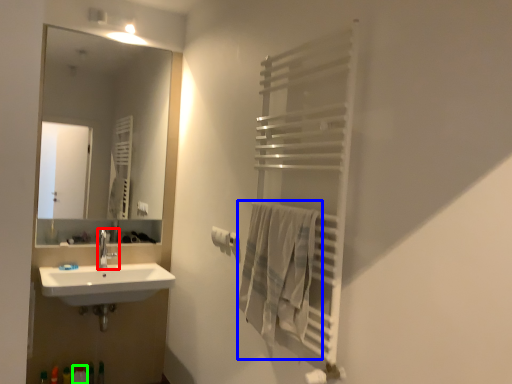
Question: Which object is positioned farthest from tap (highlighted by a red box)? Select from bath towel (highlighted by a blue box) and toiletry (highlighted by a green box).

Choices:
 (A) bath towel
 (B) toiletry

Answer: (A)